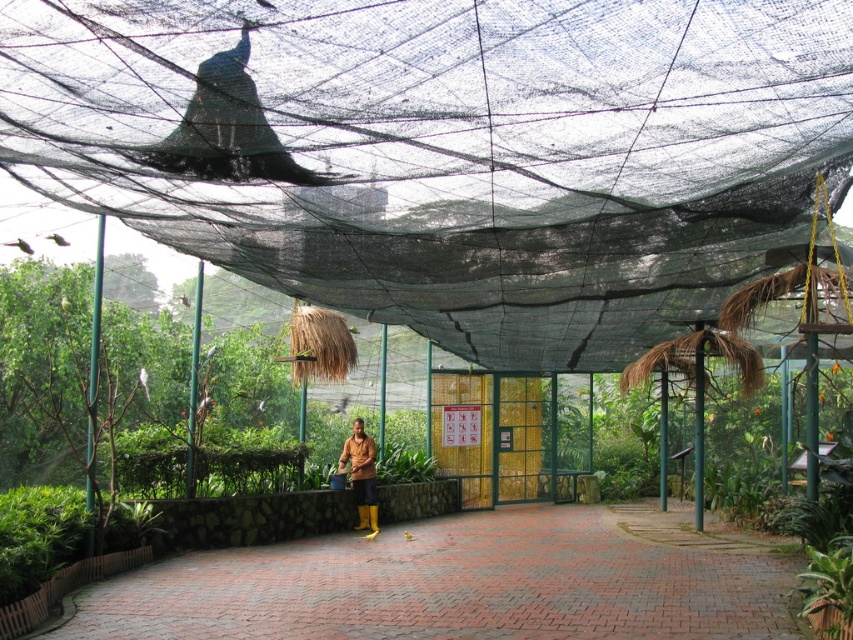
You are a visitor to the aviary and want to take a photo of the brown rubber boots at center without the black mesh net at upper center appearing in the frame. Is this possible?

The black mesh net at upper center is positioned over the brown rubber boots at center, so it will block the direct line of sight. To avoid the net, you would need to move to a position where the net is no longer between you and the boots, such as shifting your angle or moving closer to the ground level.

You are a zookeeper standing at the entrance of the aviary. You need to locate a specific point marked at coordinates point (447, 148). Based on the scene description, where would this point be located?

The point (447, 148) is on the black mesh net at upper center.